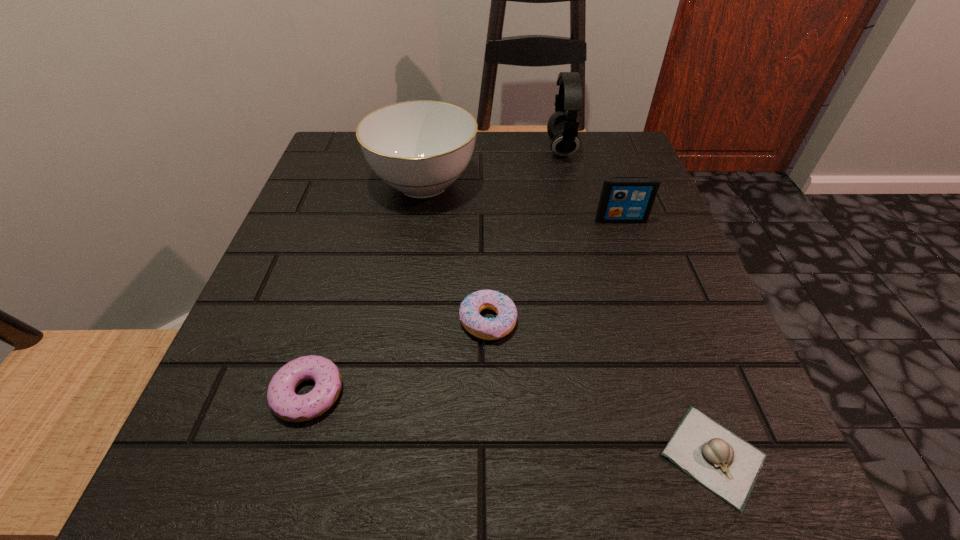
Find the location of `doughnut that is at the left edge`. doughnut that is at the left edge is located at coordinates (283, 401).

You are a GUI agent. You are given a task and a screenshot of the screen. Output one action in this format:
    pyautogui.click(x=<x>, y=<y>)
    Task: Click on the earphone situated at the right edge
    The image size is (960, 540).
    Given the screenshot: What is the action you would take?
    pyautogui.click(x=562, y=127)

At what (x,y) coordinates should I click in order to perform the action: click on iPod located at the right edge. Please return your answer as a coordinate pair (x, y). The image size is (960, 540). Looking at the image, I should click on (623, 199).

I want to click on garlic at the right edge, so click(726, 464).

Find the location of a particular element. object present at the far left corner is located at coordinates (420, 148).

Locate an element on the screen. The width and height of the screenshot is (960, 540). object positioned at the far right corner is located at coordinates (562, 127).

I want to click on object at the near right corner, so click(726, 464).

Locate an element on the screen. The image size is (960, 540). free space at the near edge is located at coordinates (516, 487).

Where is `vacant space at the left edge of the desktop`? The width and height of the screenshot is (960, 540). vacant space at the left edge of the desktop is located at coordinates (357, 248).

In the image, there is a desktop. Where is `blank space at the right edge`? The image size is (960, 540). blank space at the right edge is located at coordinates (752, 417).